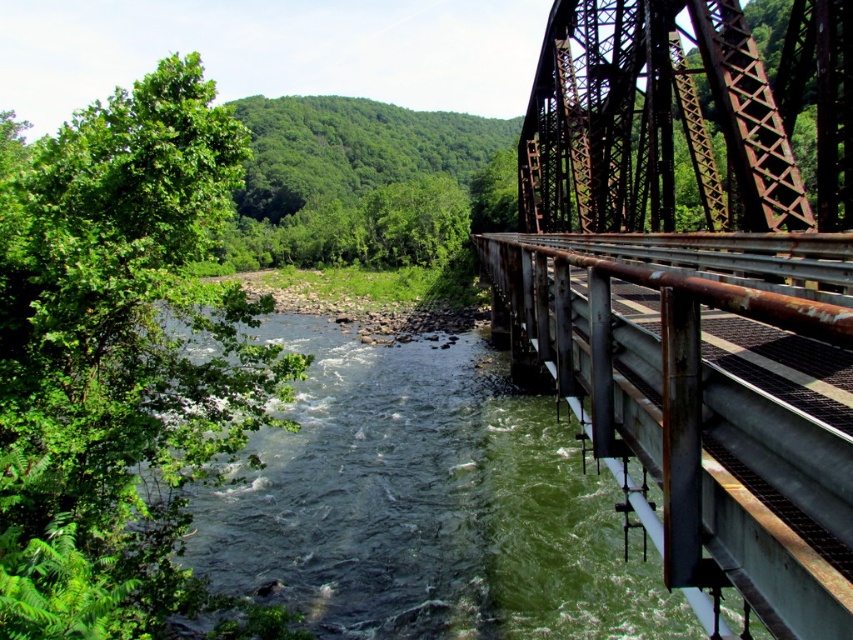
You are standing at the point labeled point (x=693, y=294) in the image. What is the material of the surface you are currently standing on?

The point (x=693, y=294) is on rusty metal bridge at right, so the surface is made of rusty metal.

You are standing at the camera position and want to cross the river using the rusty metal bridge at right. If the bridge is 10 feet long, can you safely cross it?

The distance between you and the rusty metal bridge at right is 7.31 feet, so you can safely cross it as the bridge is 10 feet long, which is longer than the distance needed to reach the other side.

You are standing on the metal truss bridge and looking towards the river. There are two points marked on the bridge surface. The first point is at coordinates point (711, 196) and the second point is at point (502, 374). Which point is closer to you when you look towards the river?

Point (711, 196) is in front of point (502, 374), so it is closer to you when looking towards the river.